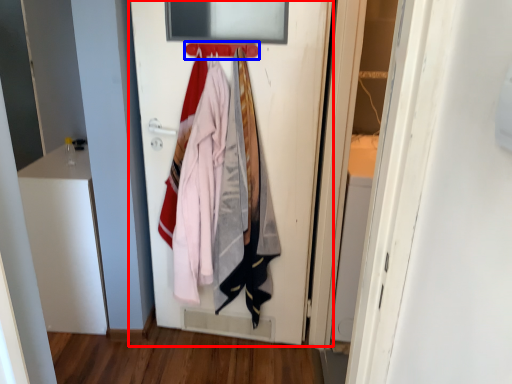
Question: Which object appears closest to the camera in this image, door (highlighted by a red box) or hanger (highlighted by a blue box)?

Choices:
 (A) door
 (B) hanger

Answer: (A)